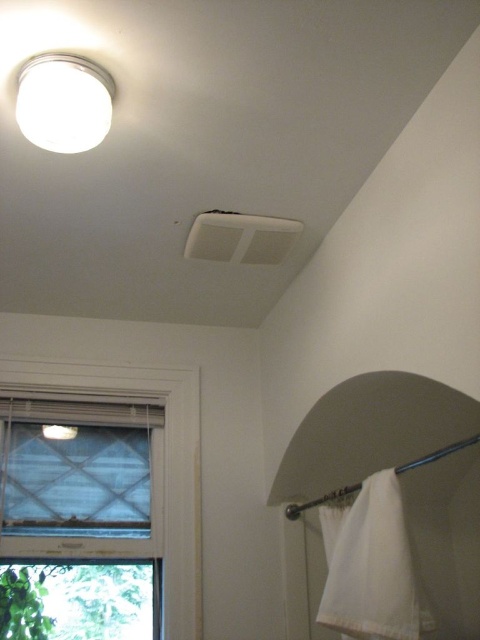
From the picture: Can you confirm if white textured window at lower left is bigger than white matte light fixture at upper left?

Yes.

Which is above, white textured window at lower left or white matte light fixture at upper left?

white matte light fixture at upper left

Does point (167, 608) come in front of point (28, 83)?

No, (167, 608) is further to viewer.

I want to click on white textured window at lower left, so click(x=164, y=456).

Is white textured window at lower left shorter than white cotton towel at lower right?

No, white textured window at lower left is not shorter than white cotton towel at lower right.

Is the position of white textured window at lower left less distant than that of white cotton towel at lower right?

No.

At what (x,y) coordinates should I click in order to perform the action: click on white textured window at lower left. Please return your answer as a coordinate pair (x, y). The image size is (480, 640). Looking at the image, I should click on (164, 456).

Between white cotton towel at lower right and white matte light fixture at upper left, which one has more height?

white cotton towel at lower right is taller.

Does white cotton towel at lower right have a larger size compared to white matte light fixture at upper left?

Yes, white cotton towel at lower right is bigger than white matte light fixture at upper left.

Who is more distant from viewer, (x=332, y=588) or (x=59, y=134)?

The point (x=332, y=588) is more distant.

Where is `white cotton towel at lower right`? This screenshot has height=640, width=480. white cotton towel at lower right is located at coordinates (371, 566).